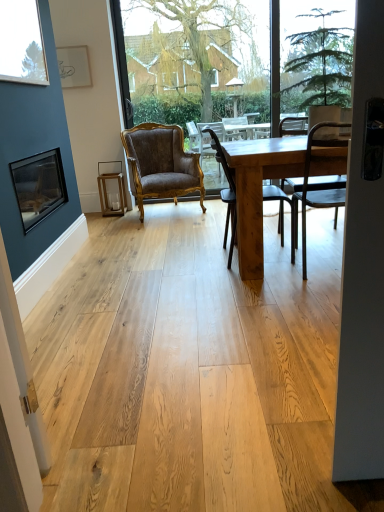
Describe the element at coordinates (226, 193) in the screenshot. The image size is (384, 512). I see `wooden chair at center, the 2th chair positioned from the left` at that location.

This screenshot has height=512, width=384. Identify the location of matte black picture frame at left. click(x=39, y=186).

This screenshot has height=512, width=384. Describe the element at coordinates (319, 55) in the screenshot. I see `green leafy plant at center, the second window screen positioned from the back` at that location.

You are a GUI agent. You are given a task and a screenshot of the screen. Output one action in this format:
    pyautogui.click(x=<x>, y=<y>)
    Task: Click on the velvet gold armchair at center, positioned as the 3th chair in front-to-back order
    The height and width of the screenshot is (512, 384).
    Given the screenshot: What is the action you would take?
    pyautogui.click(x=161, y=164)

The image size is (384, 512). What do you see at coordinates (161, 164) in the screenshot?
I see `velvet gold armchair at center, positioned as the 3th chair in front-to-back order` at bounding box center [161, 164].

Locate an element on the screen. The image size is (384, 512). wooden chair at center, which is the 2th window screen in front-to-back order is located at coordinates (228, 58).

The width and height of the screenshot is (384, 512). What do you see at coordinates (228, 58) in the screenshot?
I see `wooden chair at center, which is the 2th window screen in front-to-back order` at bounding box center [228, 58].

The image size is (384, 512). What do you see at coordinates (259, 190) in the screenshot?
I see `natural wood table at center` at bounding box center [259, 190].

The width and height of the screenshot is (384, 512). Find the location of `black metal chair at right, acting as the 3th chair starting from the back`. black metal chair at right, acting as the 3th chair starting from the back is located at coordinates (314, 185).

You are a GUI agent. You are given a task and a screenshot of the screen. Output one action in this format:
    pyautogui.click(x=<x>, y=<y>)
    Task: Click on the wooden chair at center, the 2th chair positioned from the left
    
    Given the screenshot: What is the action you would take?
    pyautogui.click(x=226, y=193)

Is the surface of wooden chair at center, marked as the second chair in a front-to-back arrangement, in direct contact with black metal chair at right, the 1th chair positioned from the front?

No, wooden chair at center, marked as the second chair in a front-to-back arrangement, is not touching black metal chair at right, the 1th chair positioned from the front.

From the image's perspective, which is above, wooden chair at center, the second chair in the back-to-front sequence, or black metal chair at right, acting as the 3th chair starting from the back?

wooden chair at center, the second chair in the back-to-front sequence, appears higher in the image.

Considering the sizes of objects wooden chair at center, marked as the second chair in a front-to-back arrangement, and black metal chair at right, the 1th chair positioned from the front, in the image provided, who is thinner, wooden chair at center, marked as the second chair in a front-to-back arrangement, or black metal chair at right, the 1th chair positioned from the front,?

With smaller width is black metal chair at right, the 1th chair positioned from the front.

Is green leafy plant at center, the second window screen positioned from the back, facing towards natural wood table at center?

No, green leafy plant at center, the second window screen positioned from the back, is not oriented towards natural wood table at center.

In the scene shown: Which object is further away from the camera, green leafy plant at center, the second window screen positioned from the back, or natural wood table at center?

natural wood table at center is further away from the camera.

Between point (329, 7) and point (254, 204), which one is positioned in front?

Positioned in front is point (329, 7).

Looking at this image, from a real-world perspective, is green leafy plant at center, the 1th window screen when ordered from front to back, above or below natural wood table at center?

From a real-world perspective, green leafy plant at center, the 1th window screen when ordered from front to back, is physically above natural wood table at center.

From the image's perspective, starting from the clear glass window at upper left, which chair is the 1st one below? Please provide its 2D coordinates.

[(161, 164)]

What's the angular difference between velvet gold armchair at center, which appears as the 1th chair when viewed from the left, and clear glass window at upper left's facing directions?

There is a 68.6-degree angle between the facing directions of velvet gold armchair at center, which appears as the 1th chair when viewed from the left, and clear glass window at upper left.

Which point is more distant from viewer, (173, 143) or (11, 16)?

The point (173, 143) is more distant.

Is clear glass window at upper left completely or partially inside velvet gold armchair at center, which ranks as the 3th chair in right-to-left order?

No.

Is black metal chair at right, which ranks as the third chair in left-to-right order, further to the viewer compared to wooden chair at center, acting as the 2th chair starting from the right?

No, black metal chair at right, which ranks as the third chair in left-to-right order, is closer to the viewer.

Image resolution: width=384 pixels, height=512 pixels. Identify the location of the 1st chair counting from the left side of the black metal chair at right, acting as the 3th chair starting from the back. (226, 193).

Is black metal chair at right, which ranks as the third chair in left-to-right order, positioned far away from wooden chair at center, marked as the second chair in a front-to-back arrangement?

They are positioned close to each other.

From the image's perspective, is black metal chair at right, which is the first chair from right to left, positioned above or below wooden chair at center, acting as the 2th chair starting from the right?

Based on their image positions, black metal chair at right, which is the first chair from right to left, is located beneath wooden chair at center, acting as the 2th chair starting from the right.

Looking at this image, is matte black picture frame at left placed right next to wooden chair at center, the second chair in the back-to-front sequence?

There is a gap between matte black picture frame at left and wooden chair at center, the second chair in the back-to-front sequence.

Considering the sizes of matte black picture frame at left and wooden chair at center, acting as the 2th chair starting from the right, in the image, is matte black picture frame at left bigger or smaller than wooden chair at center, acting as the 2th chair starting from the right,?

Clearly, matte black picture frame at left is smaller in size than wooden chair at center, acting as the 2th chair starting from the right.

Could you tell me if matte black picture frame at left is facing wooden chair at center, the second chair in the back-to-front sequence?

Yes, matte black picture frame at left is oriented towards wooden chair at center, the second chair in the back-to-front sequence.

Could wooden chair at center, the 2th chair positioned from the left, be considered to be inside matte black picture frame at left?

No, matte black picture frame at left does not contain wooden chair at center, the 2th chair positioned from the left.

Would you consider matte black picture frame at left to be distant from clear glass window at upper left?

Actually, matte black picture frame at left and clear glass window at upper left are a little close together.

Which of these two, matte black picture frame at left or clear glass window at upper left, stands taller?

clear glass window at upper left is taller.

Is clear glass window at upper left at the back of matte black picture frame at left?

No, matte black picture frame at left's orientation is not away from clear glass window at upper left.

Is matte black picture frame at left wider than clear glass window at upper left?

Indeed, matte black picture frame at left has a greater width compared to clear glass window at upper left.

Looking at their sizes, would you say black metal chair at right, the 1th chair positioned from the front, is wider or thinner than matte black picture frame at left?

black metal chair at right, the 1th chair positioned from the front, is wider than matte black picture frame at left.

From the image's perspective, which is below, black metal chair at right, acting as the 3th chair starting from the back, or matte black picture frame at left?

black metal chair at right, acting as the 3th chair starting from the back, appears lower in the image.

Can you confirm if black metal chair at right, which ranks as the third chair in left-to-right order, is bigger than matte black picture frame at left?

Yes.

The height and width of the screenshot is (512, 384). What are the coordinates of `chair that is the 2nd one above the wooden chair at center, the 2th chair positioned from the left (from a real-world perspective)` in the screenshot? It's located at (314, 185).

This screenshot has height=512, width=384. I want to click on table that is behind the green leafy plant at center, the second window screen positioned from the back, so click(259, 190).

Based on their spatial positions, is velvet gold armchair at center, which ranks as the 3th chair in right-to-left order, or black metal chair at right, which is the first chair from right to left, closer to wooden chair at center, which is the 2th window screen in front-to-back order?

Among the two, velvet gold armchair at center, which ranks as the 3th chair in right-to-left order, is located nearer to wooden chair at center, which is the 2th window screen in front-to-back order.

Estimate the real-world distances between objects in this image. Which object is further from green leafy plant at center, the 1th window screen when ordered from front to back, black metal chair at right, which is the first chair from right to left, or wooden chair at center, the second chair in the back-to-front sequence?

wooden chair at center, the second chair in the back-to-front sequence.

Estimate the real-world distances between objects in this image. Which object is closer to matte black picture frame at left, natural wood table at center or velvet gold armchair at center, which appears as the 1th chair when viewed from the left?

natural wood table at center is closer to matte black picture frame at left.

When comparing their distances from clear glass window at upper left, does natural wood table at center or green leafy plant at center, the 1th window screen when ordered from front to back, seem further?

green leafy plant at center, the 1th window screen when ordered from front to back.

Based on their spatial positions, is black metal chair at right, acting as the 3th chair starting from the back, or matte black picture frame at left closer to wooden chair at center, acting as the 2th chair starting from the right?

Among the two, black metal chair at right, acting as the 3th chair starting from the back, is located nearer to wooden chair at center, acting as the 2th chair starting from the right.

Based on their spatial positions, is velvet gold armchair at center, positioned as the 3th chair in front-to-back order, or natural wood table at center closer to wooden chair at center, marked as the second chair in a front-to-back arrangement?

Among the two, natural wood table at center is located nearer to wooden chair at center, marked as the second chair in a front-to-back arrangement.

Considering their positions, is green leafy plant at center, the 1th window screen when ordered from front to back, positioned further to black metal chair at right, which ranks as the third chair in left-to-right order, than wooden chair at center, the second chair in the back-to-front sequence?

wooden chair at center, the second chair in the back-to-front sequence, lies further to black metal chair at right, which ranks as the third chair in left-to-right order, than the other object.

Based on their spatial positions, is natural wood table at center or wooden chair at center, which ranks as the first window screen in back-to-front order, closer to clear glass window at upper left?

The object closer to clear glass window at upper left is natural wood table at center.

Identify the location of picture frame between clear glass window at upper left and wooden chair at center, which ranks as the first window screen in back-to-front order, along the z-axis. (39, 186).

Locate an element on the screen. This screenshot has width=384, height=512. window screen between black metal chair at right, which is the first chair from right to left, and wooden chair at center, which is the 2th window screen in front-to-back order, in the front-back direction is located at coordinates (319, 55).

The image size is (384, 512). I want to click on table located between black metal chair at right, the 1th chair positioned from the front, and wooden chair at center, which ranks as the first window screen in back-to-front order, in the depth direction, so click(259, 190).

Identify the location of window screen located between black metal chair at right, which ranks as the third chair in left-to-right order, and velvet gold armchair at center, positioned as the 3th chair in front-to-back order, in the depth direction. (319, 55).